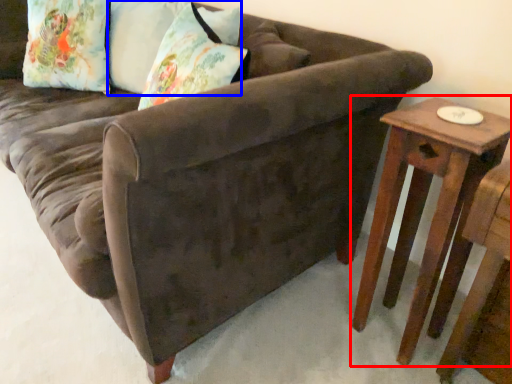
Question: Which object is further to the camera taking this photo, table (highlighted by a red box) or pillow (highlighted by a blue box)?

Choices:
 (A) table
 (B) pillow

Answer: (B)